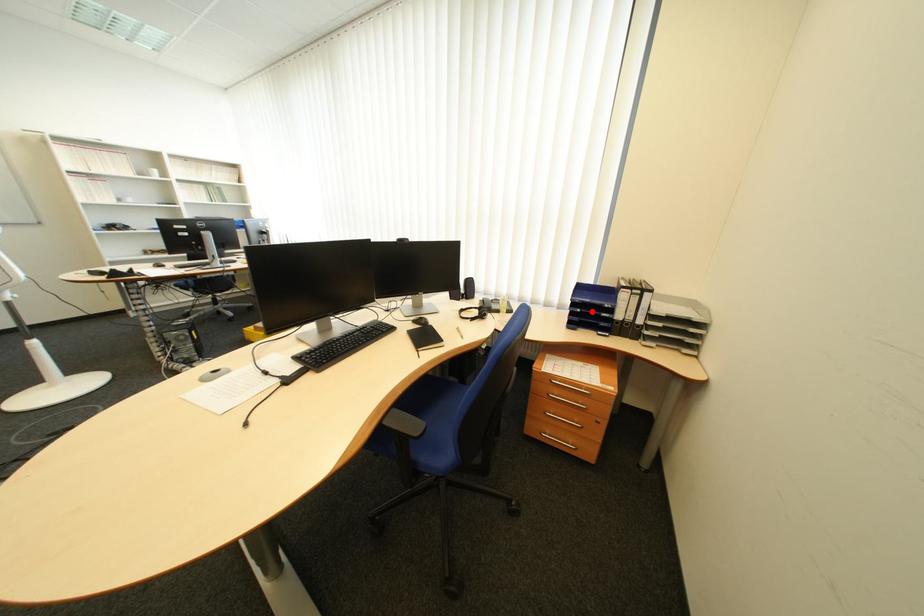
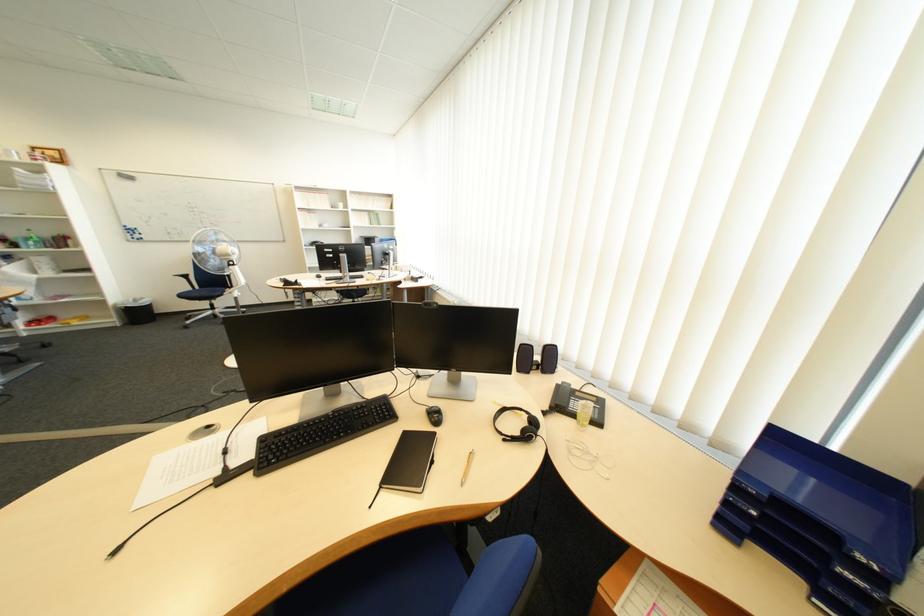
Question: I am providing you with two images of the same scene from different viewpoints. Image1 has a red point marked. In image2, the corresponding 3D location appears at what relative position? Reply with the corresponding letter.

Choices:
 (A) Closer
 (B) Farther

Answer: (B)